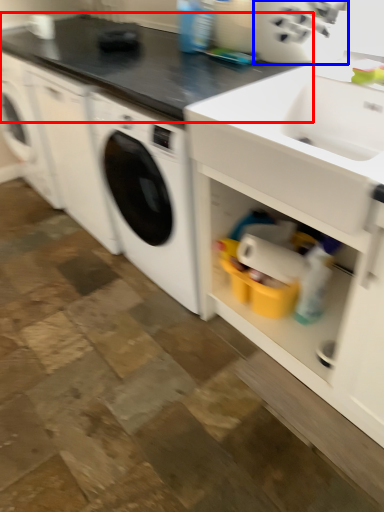
Question: Which point is further to the camera, countertop (highlighted by a red box) or appliance (highlighted by a blue box)?

Choices:
 (A) countertop
 (B) appliance

Answer: (B)